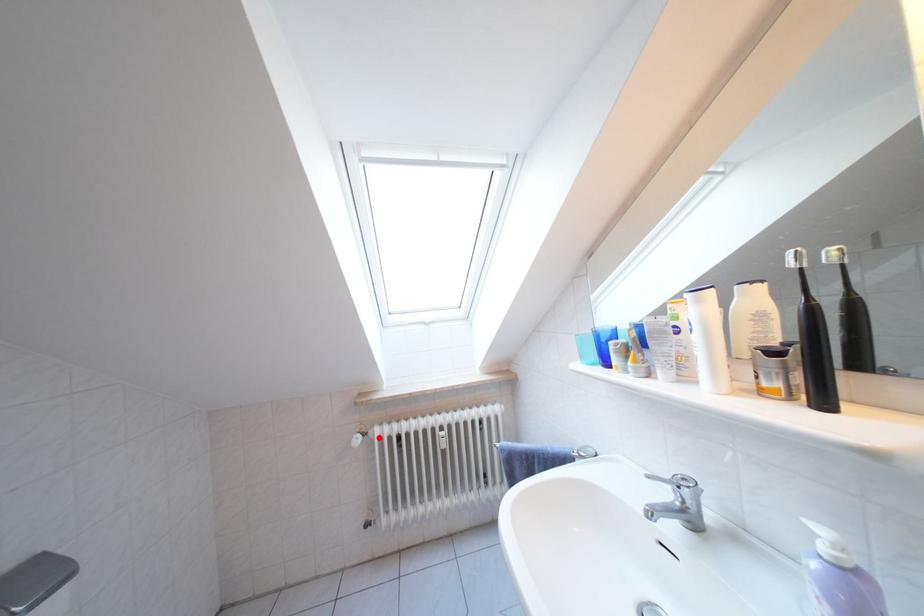
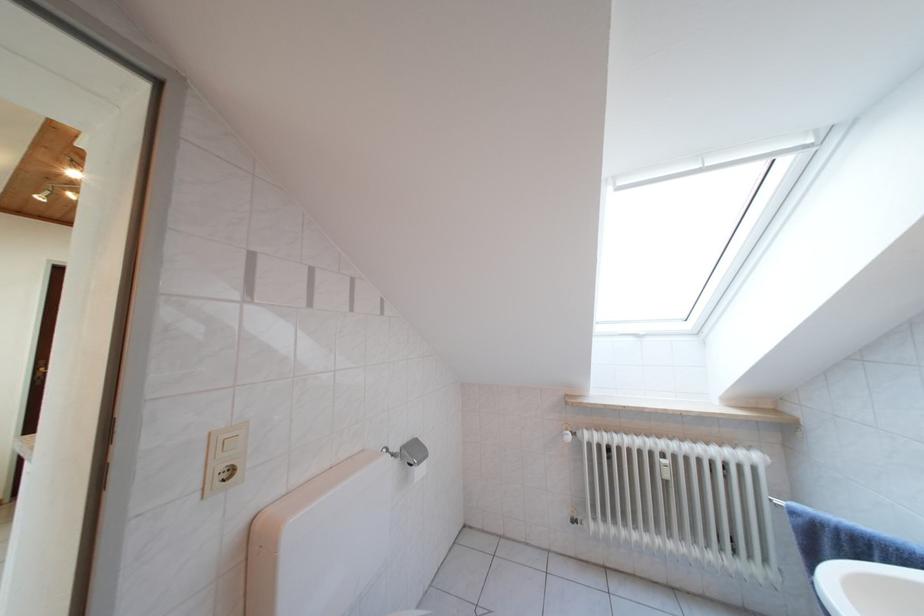
Locate, in the second image, the point that corresponds to the highlighted location in the first image.

(588, 439)